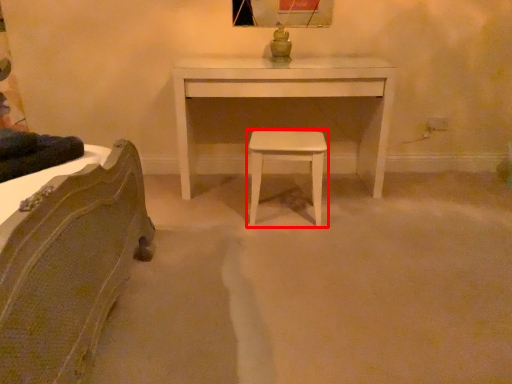
Question: From the image's perspective, what is the correct spatial positioning of stool (annotated by the red box) in reference to table?

Choices:
 (A) above
 (B) below

Answer: (B)